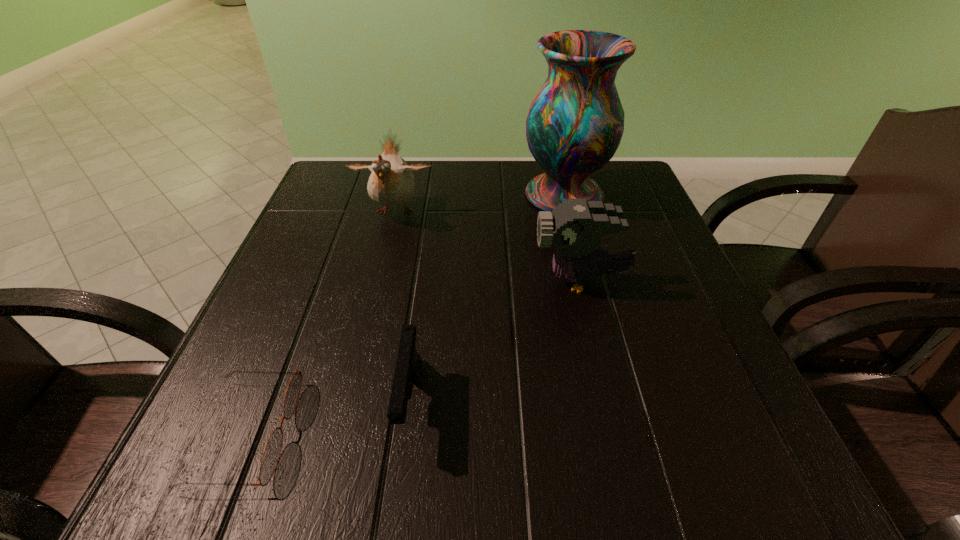
Locate an element on the screen. free space located at the beak of the nearer bird is located at coordinates (371, 281).

Locate an element on the screen. Image resolution: width=960 pixels, height=540 pixels. free space located 0.050m on the front-facing side of the fourth tallest object is located at coordinates (398, 494).

Where is `vacant space situated 0.250m on the face of the sunglasses`? vacant space situated 0.250m on the face of the sunglasses is located at coordinates (468, 432).

This screenshot has width=960, height=540. What are the coordinates of `vase present at the far edge` in the screenshot? It's located at [574, 126].

What are the coordinates of `bird that is at the far edge` in the screenshot? It's located at (391, 183).

At what (x,y) coordinates should I click in order to perform the action: click on pistol present at the near edge. Please return your answer as a coordinate pair (x, y). Looking at the image, I should click on (407, 369).

What are the coordinates of `sunglasses situated at the near edge` in the screenshot? It's located at pos(272,451).

At what (x,y) coordinates should I click in order to perform the action: click on bird that is at the left edge. Please return your answer as a coordinate pair (x, y). Looking at the image, I should click on (391, 183).

The image size is (960, 540). Identify the location of sunglasses located in the left edge section of the desktop. (272, 451).

I want to click on vase located at the right edge, so click(x=574, y=126).